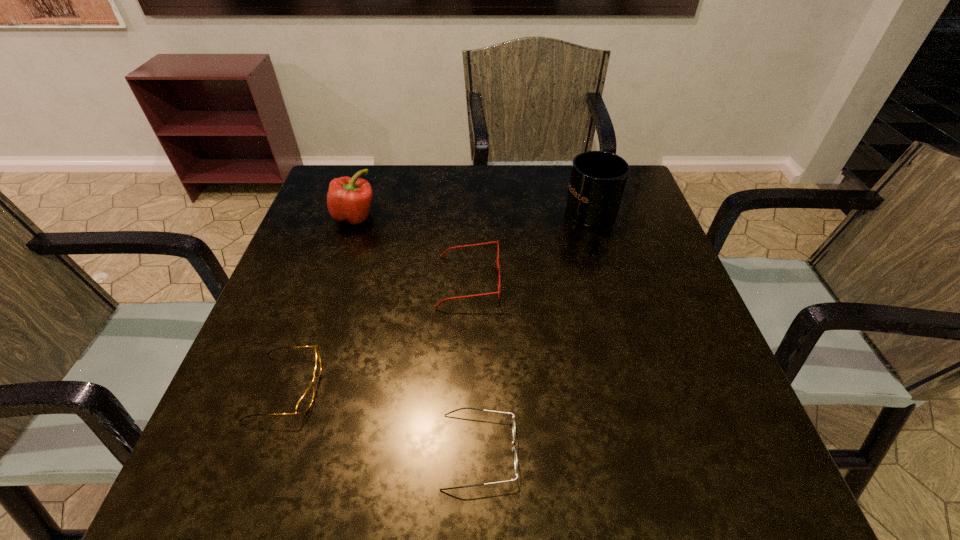
I want to click on vacant space located 0.240m on the front-facing side of the leftmost spectacles, so click(x=454, y=387).

The width and height of the screenshot is (960, 540). What are the coordinates of `mug that is positioned at the far edge` in the screenshot? It's located at (598, 178).

Identify the location of bell pepper located at the far edge. (349, 199).

Find the location of a particular element. The width and height of the screenshot is (960, 540). object situated at the near edge is located at coordinates (515, 455).

Where is `bell pepper positioned at the left edge`? bell pepper positioned at the left edge is located at coordinates (349, 199).

Where is `spectacles that is at the left edge`? This screenshot has height=540, width=960. spectacles that is at the left edge is located at coordinates (304, 403).

Locate an element on the screen. This screenshot has height=540, width=960. object that is positioned at the right edge is located at coordinates (598, 178).

In order to click on object located in the far left corner section of the desktop in this screenshot , I will do `click(349, 199)`.

In order to click on object present at the far right corner in this screenshot , I will do pos(598,178).

At what (x,y) coordinates should I click in order to perform the action: click on vacant area at the far edge of the desktop. Please return your answer as a coordinate pair (x, y). The image size is (960, 540). Looking at the image, I should click on (x=539, y=205).